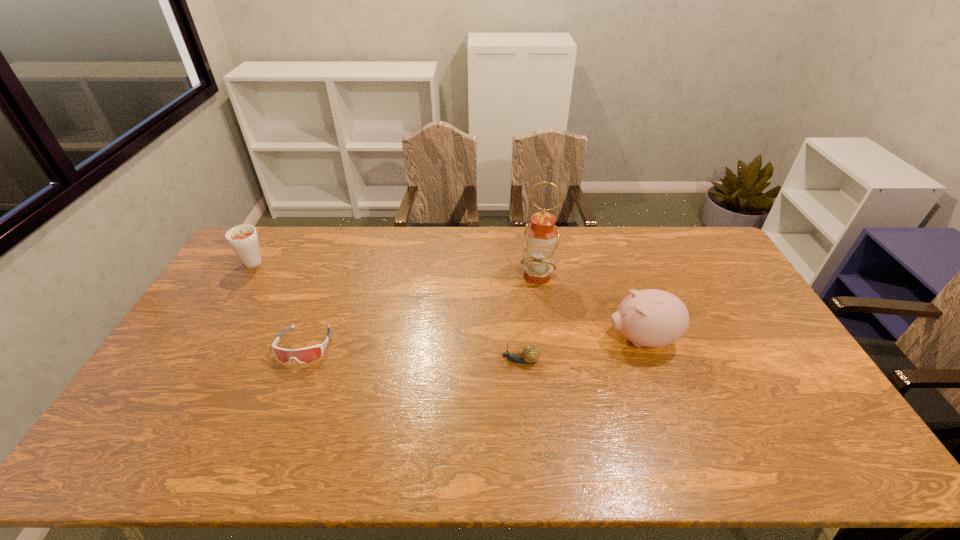
At what (x,y) coordinates should I click in order to perform the action: click on blank space at the far right corner of the desktop. Please return your answer as a coordinate pair (x, y). Image resolution: width=960 pixels, height=540 pixels. Looking at the image, I should click on (709, 239).

This screenshot has width=960, height=540. Identify the location of free area in between the second object from left to right and the piggy bank. (473, 342).

Locate an element on the screen. The height and width of the screenshot is (540, 960). unoccupied area between the root beer and the goggles is located at coordinates [278, 306].

At what (x,y) coordinates should I click in order to perform the action: click on free space between the escargot and the piggy bank. Please return your answer as a coordinate pair (x, y). Image resolution: width=960 pixels, height=540 pixels. Looking at the image, I should click on (581, 350).

You are a GUI agent. You are given a task and a screenshot of the screen. Output one action in this format:
    pyautogui.click(x=<x>, y=<y>)
    Task: Click on the free spot between the oil lamp and the leftmost object
    The width and height of the screenshot is (960, 540).
    Given the screenshot: What is the action you would take?
    pyautogui.click(x=395, y=271)

Identify the location of free spot between the fourth object from right to left and the root beer. (278, 306).

At what (x,y) coordinates should I click in order to perform the action: click on empty space that is in between the piggy bank and the oil lamp. Please return your answer as a coordinate pair (x, y). The height and width of the screenshot is (540, 960). Looking at the image, I should click on (589, 307).

You are a GUI agent. You are given a task and a screenshot of the screen. Output one action in this format:
    pyautogui.click(x=<x>, y=<y>)
    Task: Click on the blank region between the piggy bank and the goggles
    
    Given the screenshot: What is the action you would take?
    pyautogui.click(x=473, y=342)

Where is `vacant area that lies between the leftmost object and the escargot`? vacant area that lies between the leftmost object and the escargot is located at coordinates (385, 314).

The width and height of the screenshot is (960, 540). In order to click on vacant space that's between the second object from left to right and the tallest object in this screenshot , I will do `click(420, 310)`.